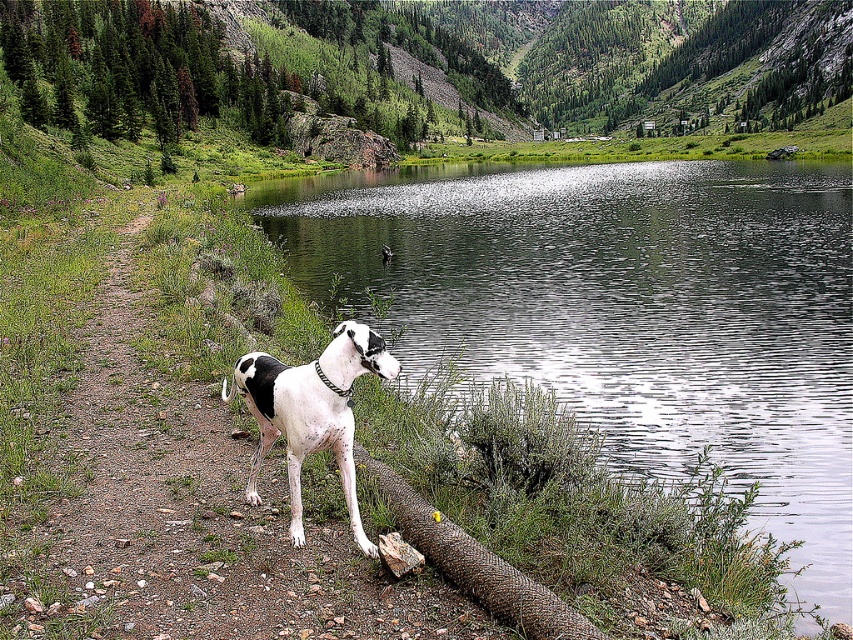
You are standing at point (358,461) and want to walk towards the dog on the dirt path. Which direction should you move to reach the dog located at point (425,365)?

Since point (425,365) is behind point (358,461), you should move backward to reach the dog located at point (425,365).

You are a photographer trying to capture the dog in the scene. You need to position your camera so that the black and white fur at center is visible above the rustic wood log at lower center. Is this possible given their positions?

Yes, the black and white fur at center is positioned above the rustic wood log at lower center, so the photographer can adjust the camera angle to ensure the dog appears above the log in the photo.

You are standing at the point marked by the coordinates point (x=311, y=412). Looking around, you see the dog with black and white fur at center. Can you determine the direction the dog is facing relative to your position?

The dog with black and white fur at center is facing towards the lake, so if you are at point (x=311, y=412), the dog is facing away from you towards the lake.